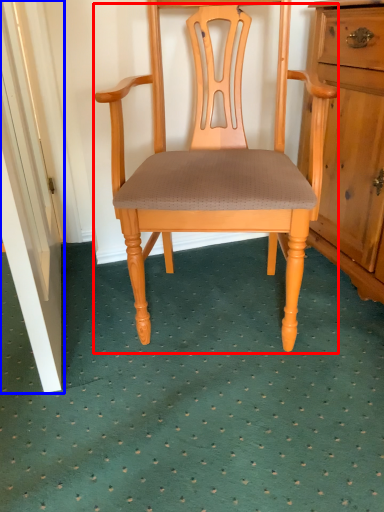
Question: Which of the following is the closest to the observer, chair (highlighted by a red box) or door (highlighted by a blue box)?

Choices:
 (A) chair
 (B) door

Answer: (B)